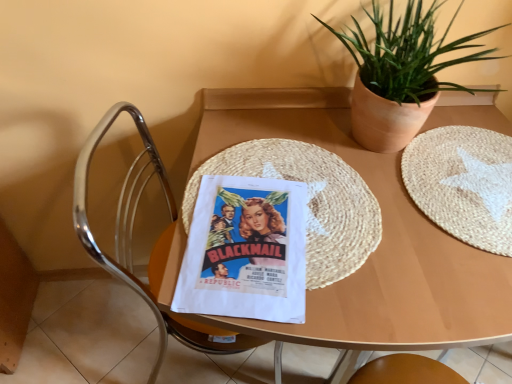
Find the location of a particular element. vacant space underneath green leafy plant in clay pot at upper right (from a real-world perspective) is located at coordinates (375, 145).